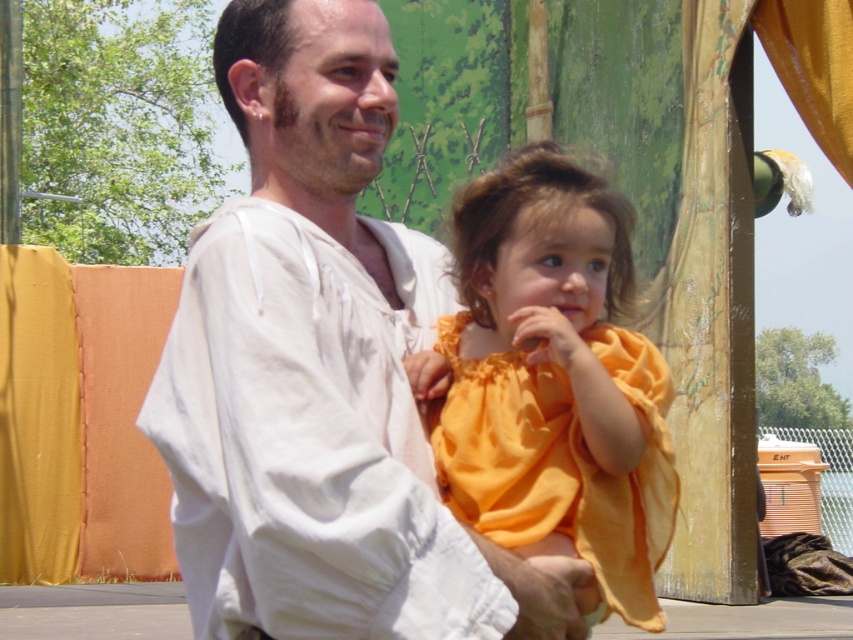
Question: Which point is farther from the camera taking this photo?

Choices:
 (A) (480, 356)
 (B) (396, 595)

Answer: (A)

Question: Which point is farther to the camera?

Choices:
 (A) [x=355, y=544]
 (B) [x=654, y=419]

Answer: (B)

Question: Does white cotton shirt at center appear under matte orange dress at center?

Choices:
 (A) yes
 (B) no

Answer: (B)

Question: Does white cotton shirt at center have a larger size compared to matte orange dress at center?

Choices:
 (A) yes
 (B) no

Answer: (A)

Question: Which object is farther from the camera taking this photo?

Choices:
 (A) white cotton shirt at center
 (B) matte orange dress at center

Answer: (B)

Question: Can you confirm if white cotton shirt at center is positioned to the right of matte orange dress at center?

Choices:
 (A) no
 (B) yes

Answer: (A)